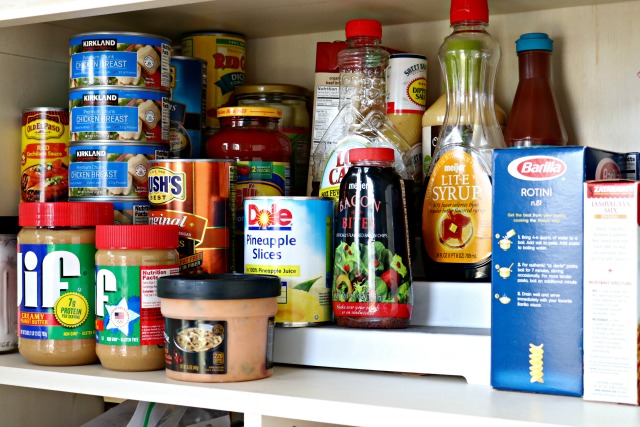
Locate an element on the screen. The width and height of the screenshot is (640, 427). food in jars is located at coordinates (36, 297), (132, 306), (256, 156), (285, 103).